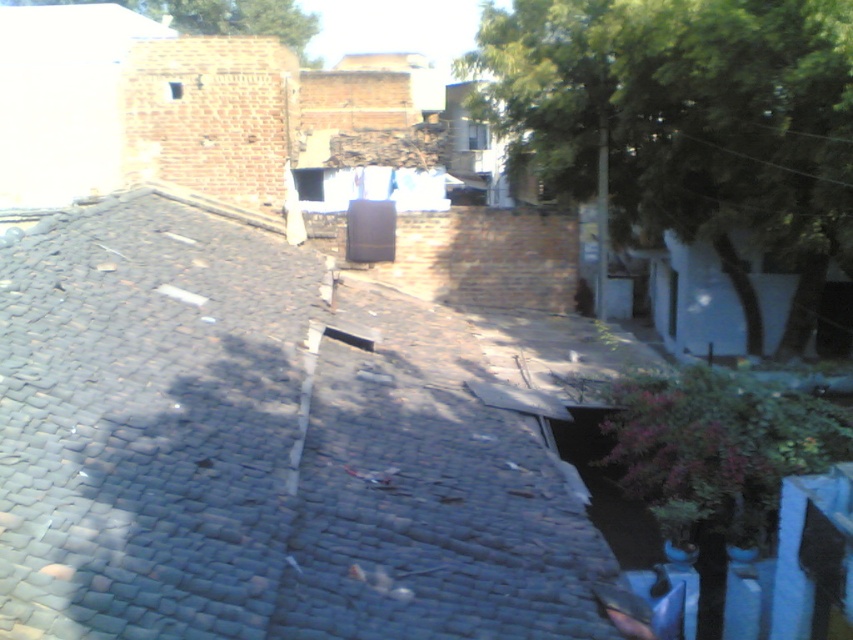
Which of these two, green leafy tree at upper right or green leafy tree at upper center, stands taller?

With more height is green leafy tree at upper right.

Is green leafy tree at upper right positioned behind green leafy tree at upper center?

No, green leafy tree at upper right is closer to the viewer.

Does point (827, 132) come closer to viewer compared to point (299, 60)?

Yes, it is.

This screenshot has width=853, height=640. What are the coordinates of `green leafy tree at upper right` in the screenshot? It's located at (689, 122).

Which is more to the left, dark gray shingles at center or green leafy tree at upper center?

From the viewer's perspective, green leafy tree at upper center appears more on the left side.

Looking at this image, which is below, dark gray shingles at center or green leafy tree at upper center?

dark gray shingles at center is below.

The width and height of the screenshot is (853, 640). I want to click on dark gray shingles at center, so click(260, 451).

Does dark gray shingles at center have a lesser height compared to green leafy tree at upper right?

Indeed, dark gray shingles at center has a lesser height compared to green leafy tree at upper right.

Is dark gray shingles at center smaller than green leafy tree at upper right?

Yes.

Measure the distance between dark gray shingles at center and camera.

dark gray shingles at center and camera are 11.22 feet apart.

Identify the location of dark gray shingles at center. The width and height of the screenshot is (853, 640). [x=260, y=451].